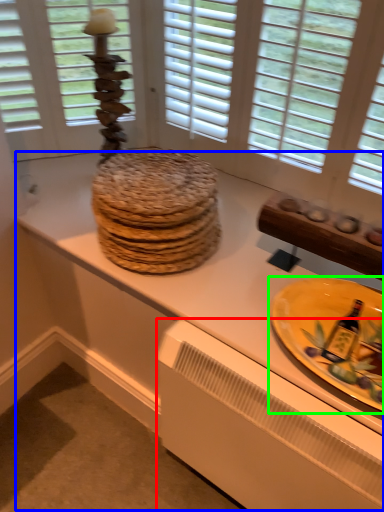
Question: Estimate the real-world distances between objects in this image. Which object is farther from radiator (highlighted by a red box), counter top (highlighted by a blue box) or plate (highlighted by a green box)?

Choices:
 (A) counter top
 (B) plate

Answer: (B)